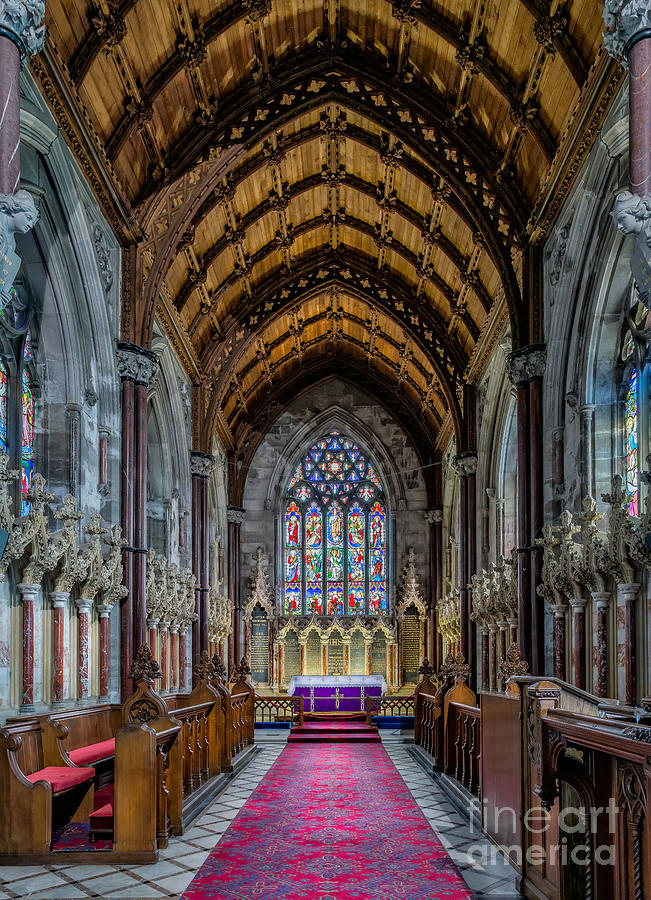
Locate an element on the screen. This screenshot has width=651, height=900. kneeling stool is located at coordinates (105, 807).